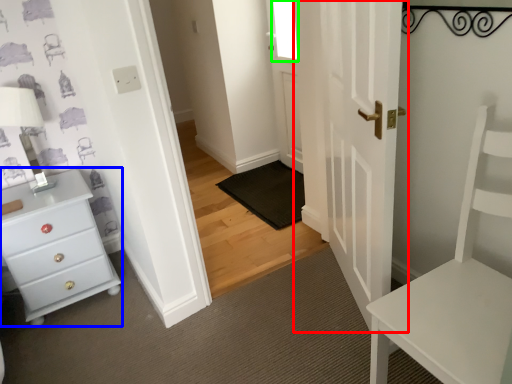
Question: Which is farther away from door (highlighted by a red box)? chest of drawers (highlighted by a blue box) or window (highlighted by a green box)?

Choices:
 (A) chest of drawers
 (B) window

Answer: (A)